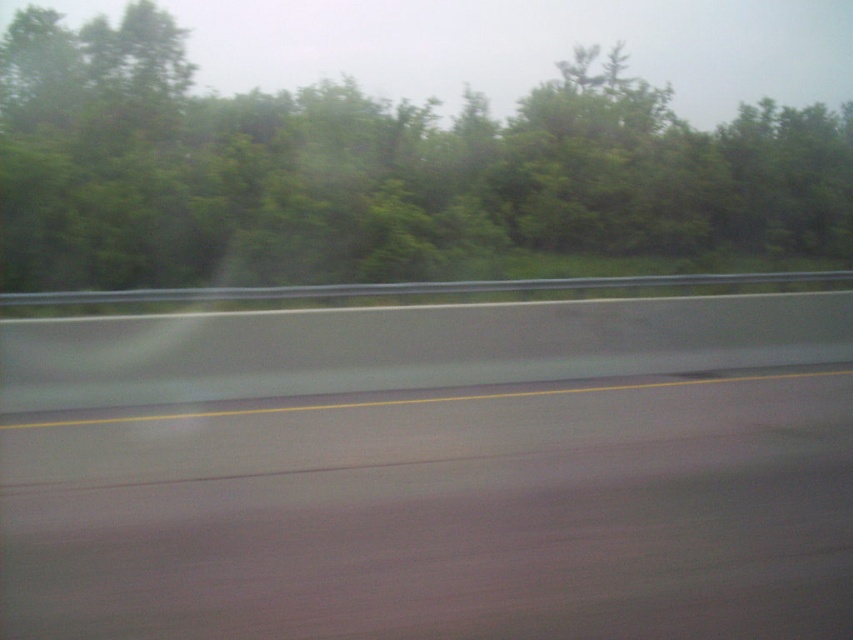
Does smooth asphalt highway at center have a greater width compared to green leafy tree at upper center?

In fact, smooth asphalt highway at center might be narrower than green leafy tree at upper center.

Who is positioned more to the right, smooth asphalt highway at center or green leafy tree at upper center?

Positioned to the right is green leafy tree at upper center.

What are the coordinates of `smooth asphalt highway at center` in the screenshot? It's located at (440, 515).